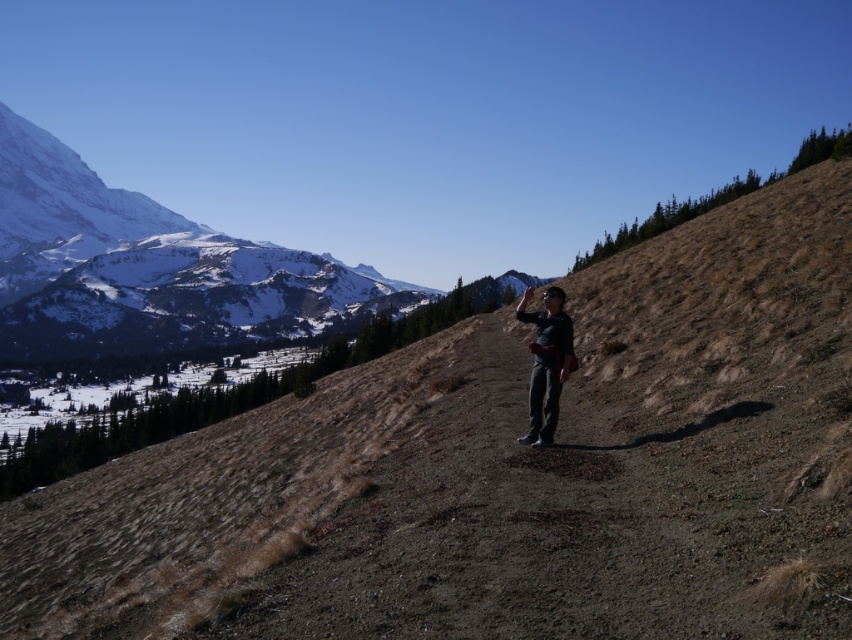
Question: Can you confirm if snowy granite mountain at upper left is positioned to the left of dark gray pants at center?

Choices:
 (A) yes
 (B) no

Answer: (A)

Question: Is snowy granite mountain at upper left positioned before dark gray pants at center?

Choices:
 (A) no
 (B) yes

Answer: (A)

Question: Does snowy granite mountain at upper left appear under dark gray pants at center?

Choices:
 (A) no
 (B) yes

Answer: (A)

Question: Which of the following is the farthest from the observer?

Choices:
 (A) (280, 305)
 (B) (544, 314)

Answer: (A)